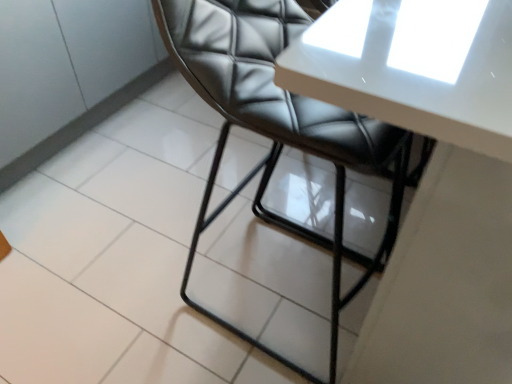
Image resolution: width=512 pixels, height=384 pixels. I want to click on free region under black leather chair at center (from a real-world perspective), so click(x=260, y=276).